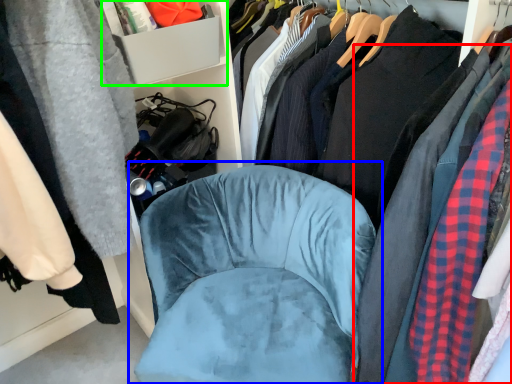
Question: Based on their relative distances, which object is nearer to clothing (highlighted by a red box)? Choose from chair (highlighted by a blue box) and cabinet (highlighted by a green box).

Choices:
 (A) chair
 (B) cabinet

Answer: (A)